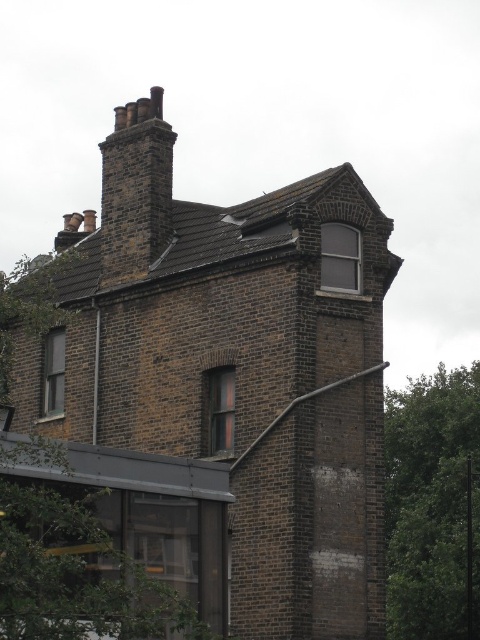
You are standing in front of a brick building with a steep roof. There are multiple chimneys. You see a point marked at coordinates (x=226, y=387). What does this point represent?

The point at (x=226, y=387) represents the brown brick chimney at upper center.

You are standing in front of the brick building and notice two green leafy trees. Which tree, the green leafy tree at left or the green leafy tree at right, is closer to you?

The green leafy tree at left is closer to you because it is in front of the green leafy tree at right.